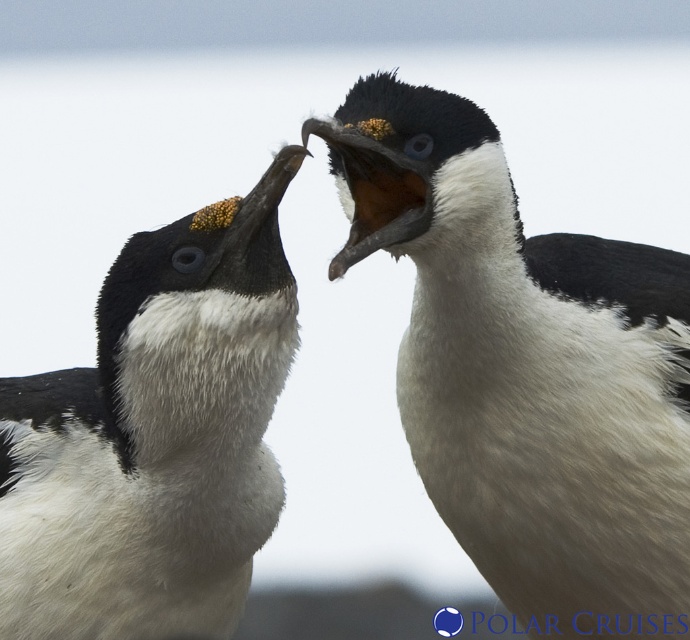
Does white soft feathers at center appear on the left side of white fluffy penguin at left?

A: Incorrect, white soft feathers at center is not on the left side of white fluffy penguin at left.

Which is above, white soft feathers at center or white fluffy penguin at left?

Positioned higher is white soft feathers at center.

Image resolution: width=690 pixels, height=640 pixels. Identify the location of white soft feathers at center. (524, 364).